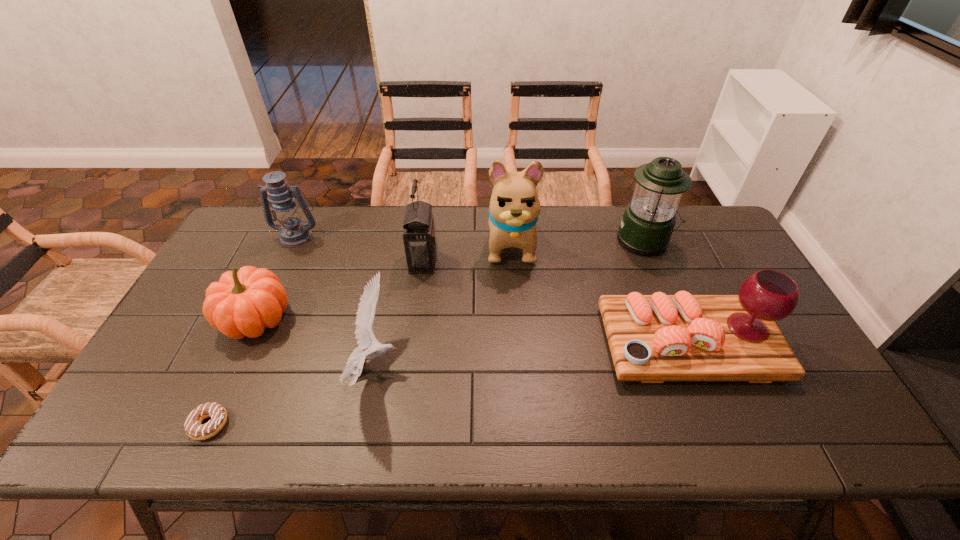
You are a GUI agent. You are given a task and a screenshot of the screen. Output one action in this format:
    pyautogui.click(x=<x>, y=<y>)
    Task: Click on the free point that satisfies the following two spatial constraints: 1. on the front-facing side of the second lantern from left to right; 2. on the front side of the doughnut
    The height and width of the screenshot is (540, 960).
    Given the screenshot: What is the action you would take?
    pyautogui.click(x=401, y=424)

The height and width of the screenshot is (540, 960). Find the location of `vacant area that satisfies the following two spatial constraints: 1. on the face of the puppy; 2. at the tip of the beak of the gull`. vacant area that satisfies the following two spatial constraints: 1. on the face of the puppy; 2. at the tip of the beak of the gull is located at coordinates (520, 366).